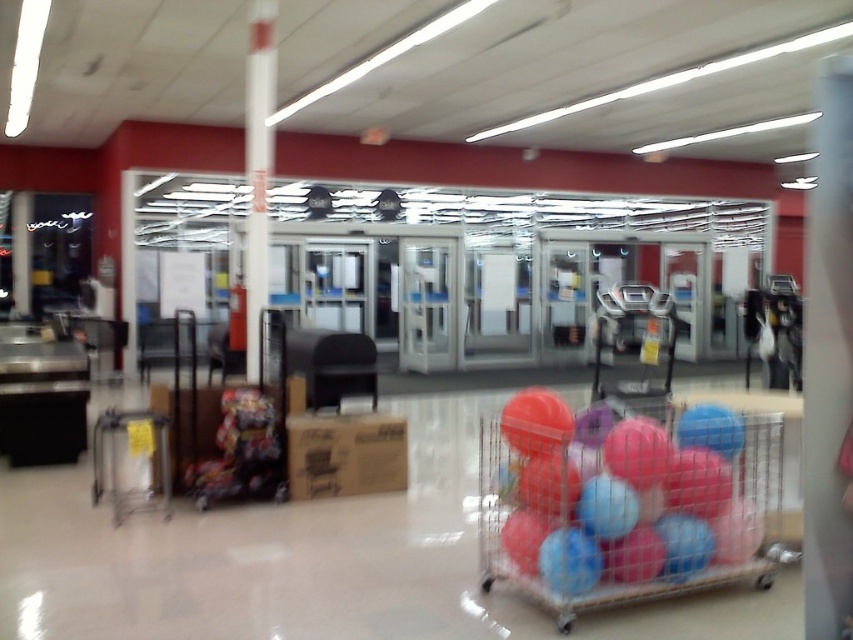
Who is taller, rubberized plastic ball at center or white glossy pole at center?

white glossy pole at center is taller.

Does point (758, 486) lie in front of point (254, 81)?

Yes, point (758, 486) is in front of point (254, 81).

Which is behind, point (728, 442) or point (260, 214)?

Point (260, 214)

Where is `rubberized plastic ball at center`? rubberized plastic ball at center is located at coordinates (624, 499).